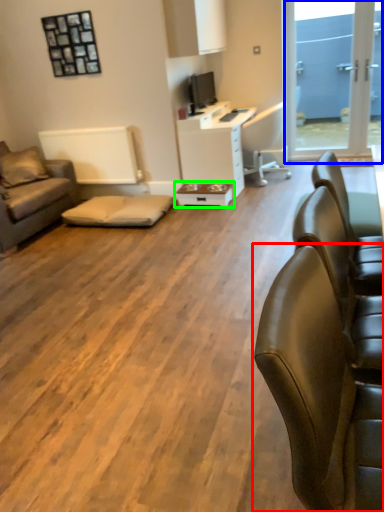
Question: Estimate the real-world distances between objects in this image. Which object is closer to chair (highlighted by a red box), window screen (highlighted by a blue box) or table (highlighted by a green box)?

Choices:
 (A) window screen
 (B) table

Answer: (B)